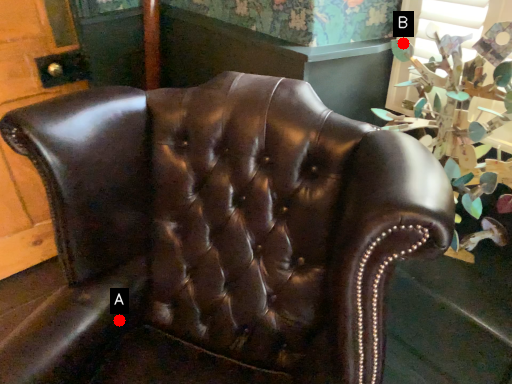
Question: Two points are circled on the image, labeled by A and B beside each circle. Which point is farther to the camera?

Choices:
 (A) A is further
 (B) B is further

Answer: (B)